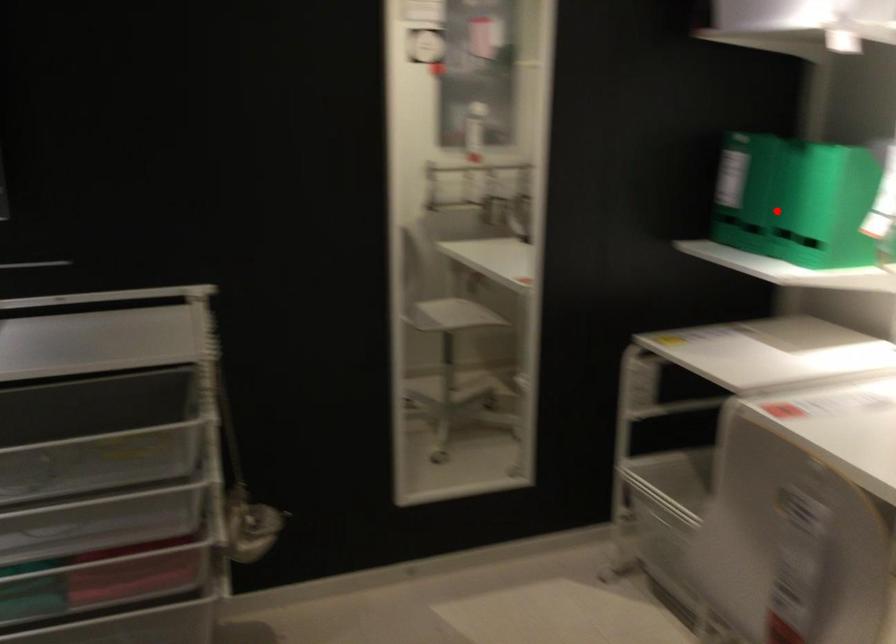
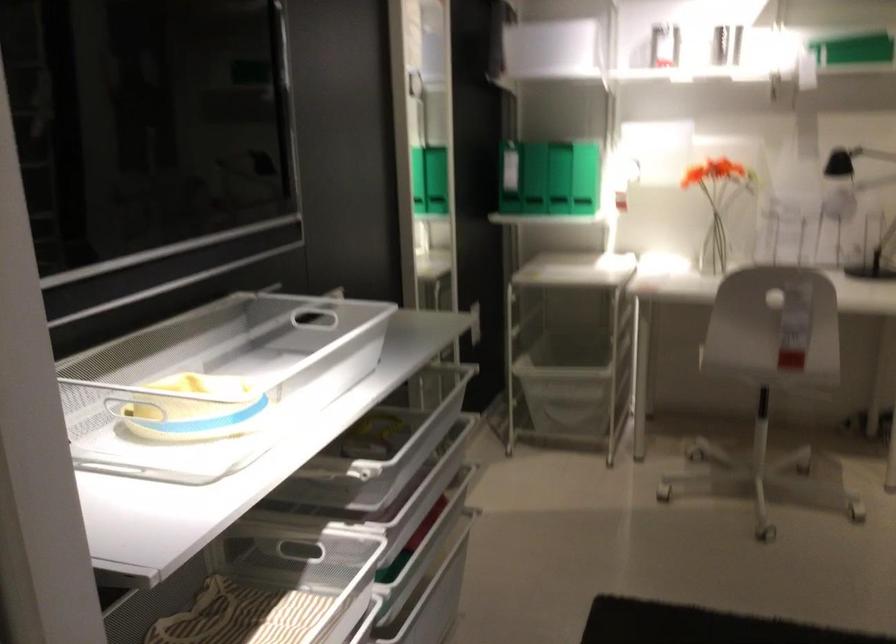
Locate, in the second image, the point that corresponds to the highlighted location in the first image.

(558, 178)